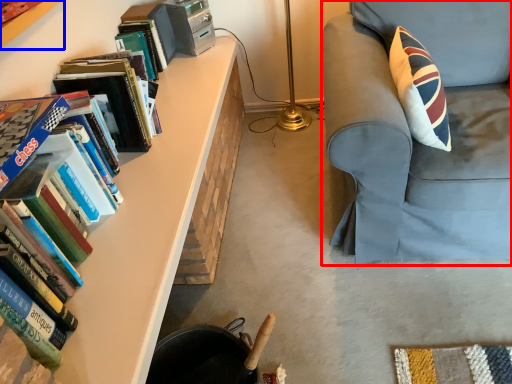
Question: Which point is further to the camera, chair (highlighted by a red box) or bookcase (highlighted by a blue box)?

Choices:
 (A) chair
 (B) bookcase

Answer: (A)